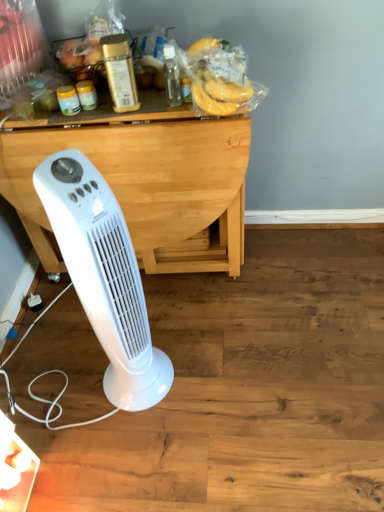
You are a GUI agent. You are given a task and a screenshot of the screen. Output one action in this format:
    pyautogui.click(x=<x>, y=<y>)
    Task: Click on the free space in front of wooden table at center
    
    Given the screenshot: What is the action you would take?
    pyautogui.click(x=165, y=373)